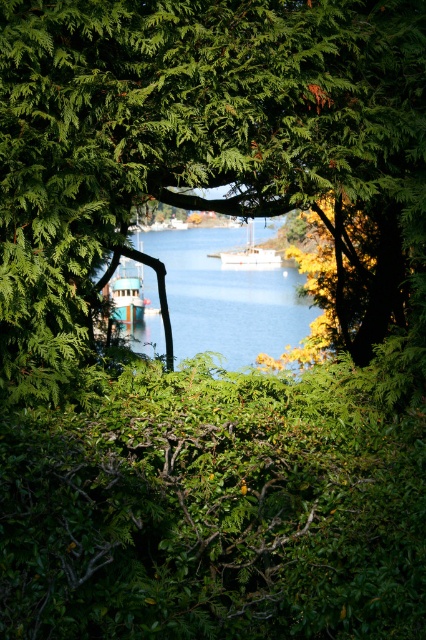
Question: Can you confirm if blue water at center is bigger than white matte sailboat at center?

Choices:
 (A) yes
 (B) no

Answer: (A)

Question: Which point is farther to the camera?

Choices:
 (A) (253, 259)
 (B) (40, 381)

Answer: (A)

Question: Does blue water at center appear on the right side of teal glossy boat at center?

Choices:
 (A) no
 (B) yes

Answer: (B)

Question: Which of the following is the closest to the observer?

Choices:
 (A) blue water at center
 (B) green leafy tree at center
 (C) white matte sailboat at center

Answer: (B)

Question: Is green leafy tree at center below blue water at center?

Choices:
 (A) no
 (B) yes

Answer: (A)

Question: Among these objects, which one is farthest from the camera?

Choices:
 (A) blue water at center
 (B) white matte sailboat at center

Answer: (B)